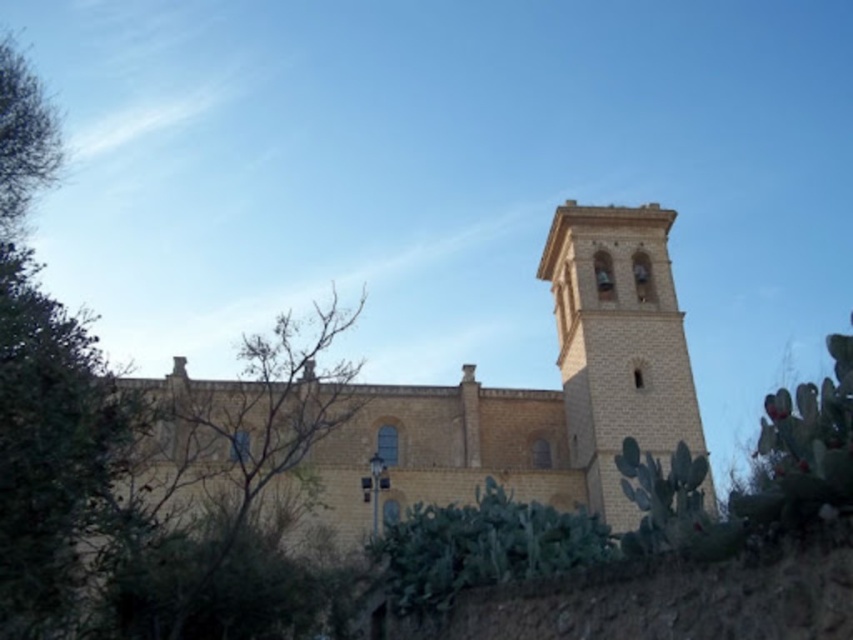
Can you confirm if green leafy tree at left is thinner than green spiny cactus at lower center?

In fact, green leafy tree at left might be wider than green spiny cactus at lower center.

Between point (22, 568) and point (514, 545), which one is positioned behind?

Positioned behind is point (514, 545).

Where is `green leafy tree at left`? This screenshot has height=640, width=853. green leafy tree at left is located at coordinates (47, 401).

This screenshot has width=853, height=640. Describe the element at coordinates (618, 342) in the screenshot. I see `light beige stone bell tower at center right` at that location.

Who is lower down, light beige stone bell tower at center right or green leafy tree at center?

green leafy tree at center is lower down.

The image size is (853, 640). Describe the element at coordinates (618, 342) in the screenshot. I see `light beige stone bell tower at center right` at that location.

Where is `light beige stone bell tower at center right`? light beige stone bell tower at center right is located at coordinates (618, 342).

Where is `yellow stone church at center`? yellow stone church at center is located at coordinates [x=540, y=388].

Between point (688, 376) and point (582, 442), which one is positioned in front?

Point (582, 442)

This screenshot has height=640, width=853. I want to click on yellow stone church at center, so click(x=540, y=388).